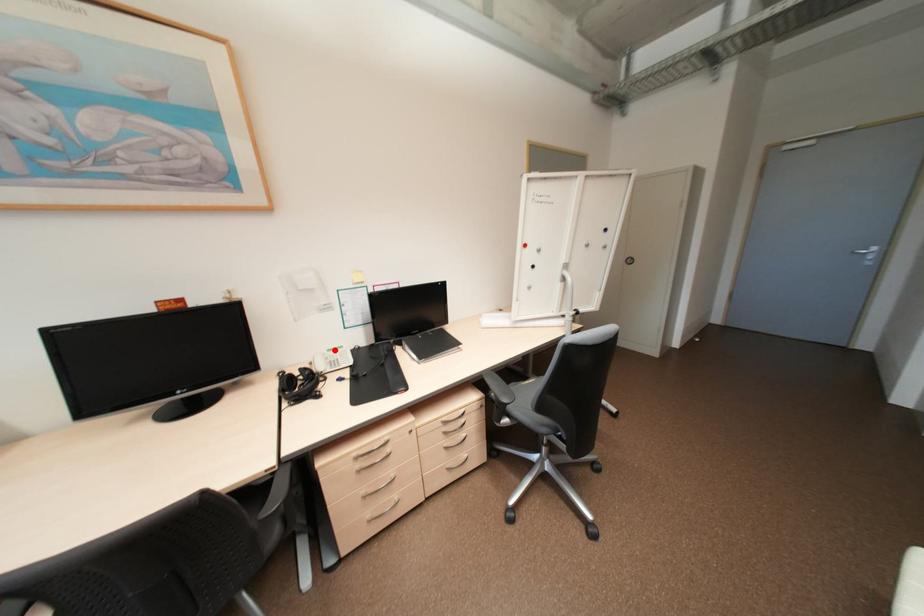
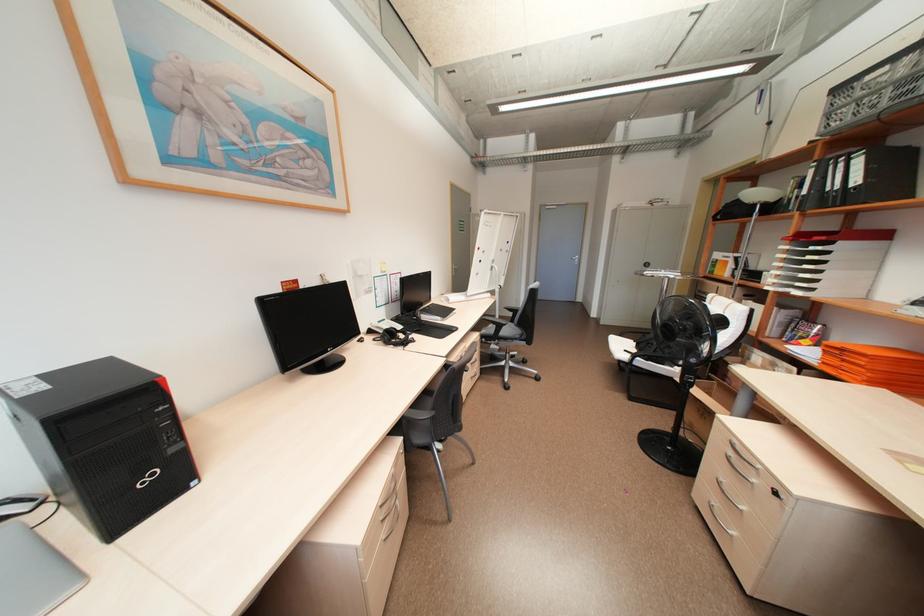
The point at the highlighted location is marked in the first image. Where is the corresponding point in the second image?

(384, 322)